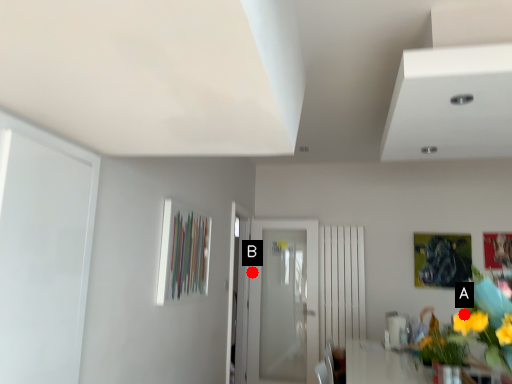
Question: Two points are circled on the image, labeled by A and B beside each circle. Which point appears farthest from the camera in this image?

Choices:
 (A) A is further
 (B) B is further

Answer: (B)